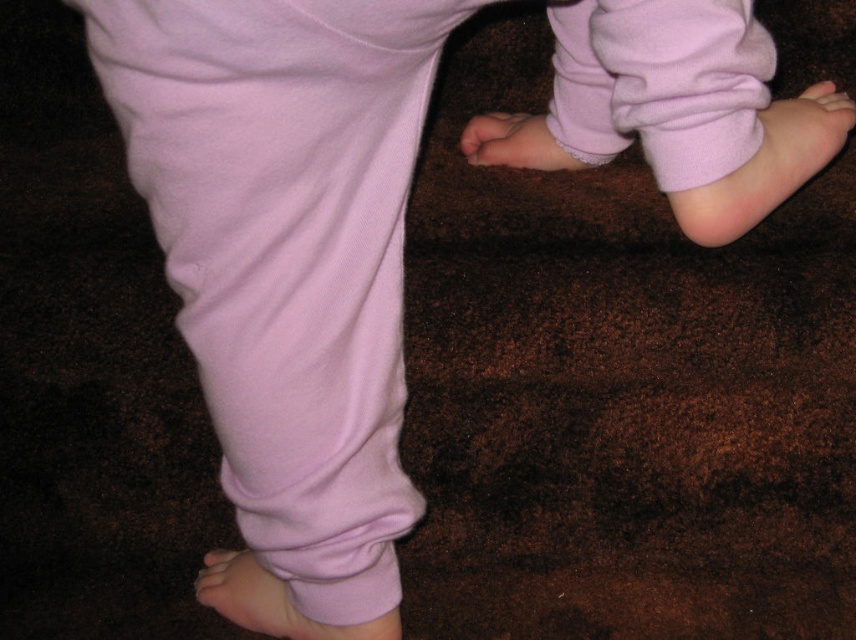
Question: Which object is farther from the camera taking this photo?

Choices:
 (A) pink soft fabric foot at center
 (B) pink soft skin at lower right
 (C) pink soft fabric foot at lower left
 (D) pink soft fabric foot at lower right

Answer: (A)

Question: Is pink soft fabric foot at lower right above pink soft fabric foot at lower left?

Choices:
 (A) no
 (B) yes

Answer: (B)

Question: Is pink soft fabric foot at lower right positioned before pink soft fabric foot at lower left?

Choices:
 (A) yes
 (B) no

Answer: (B)

Question: Which of these objects is positioned farthest from the pink soft fabric toe at lower left?

Choices:
 (A) pink soft fabric foot at center
 (B) pink soft skin at lower right
 (C) pink soft fabric foot at lower left

Answer: (B)

Question: Which point is closer to the camera?

Choices:
 (A) (801, 116)
 (B) (224, 552)

Answer: (A)

Question: Can you confirm if pink soft fabric toe at lower left is positioned to the right of pink soft skin at lower right?

Choices:
 (A) yes
 (B) no

Answer: (B)